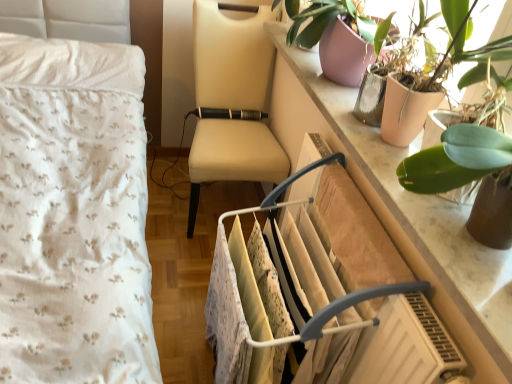
Question: Is white plastic clothes rack at center closer to the viewer compared to green leafy plant at upper right, which appears as the 2th houseplant when viewed from the back?

Choices:
 (A) no
 (B) yes

Answer: (A)

Question: Considering the relative positions of white plastic clothes rack at center and green leafy plant at upper right, which appears as the 2th houseplant when viewed from the back, in the image provided, is white plastic clothes rack at center to the left of green leafy plant at upper right, which appears as the 2th houseplant when viewed from the back, from the viewer's perspective?

Choices:
 (A) yes
 (B) no

Answer: (A)

Question: Considering the relative sizes of white plastic clothes rack at center and green leafy plant at upper right, which appears as the 2th houseplant when viewed from the back, in the image provided, is white plastic clothes rack at center thinner than green leafy plant at upper right, which appears as the 2th houseplant when viewed from the back,?

Choices:
 (A) yes
 (B) no

Answer: (B)

Question: Does white plastic clothes rack at center have a greater height compared to green leafy plant at upper right, the first houseplant in the front-to-back sequence?

Choices:
 (A) yes
 (B) no

Answer: (A)

Question: Does white plastic clothes rack at center have a greater width compared to green leafy plant at upper right, which appears as the 2th houseplant when viewed from the back?

Choices:
 (A) no
 (B) yes

Answer: (B)

Question: From a real-world perspective, relative to beige leather chair at center, is white plastic clothes rack at center vertically above or below?

Choices:
 (A) above
 (B) below

Answer: (B)

Question: Is white plastic clothes rack at center to the left or to the right of beige leather chair at center in the image?

Choices:
 (A) right
 (B) left

Answer: (A)

Question: In terms of size, does white plastic clothes rack at center appear bigger or smaller than beige leather chair at center?

Choices:
 (A) big
 (B) small

Answer: (B)

Question: Is white plastic clothes rack at center wider or thinner than beige leather chair at center?

Choices:
 (A) thin
 (B) wide

Answer: (A)

Question: Would you say green leafy plant at upper right, the first houseplant in the front-to-back sequence, is to the left or to the right of white plastic clothes rack at center in the picture?

Choices:
 (A) right
 (B) left

Answer: (A)

Question: Is green leafy plant at upper right, which appears as the 2th houseplant when viewed from the back, inside the boundaries of white plastic clothes rack at center, or outside?

Choices:
 (A) inside
 (B) outside

Answer: (B)

Question: In terms of width, does green leafy plant at upper right, the first houseplant in the front-to-back sequence, look wider or thinner when compared to white plastic clothes rack at center?

Choices:
 (A) wide
 (B) thin

Answer: (B)

Question: Considering the positions of green leafy plant at upper right, the first houseplant in the front-to-back sequence, and white plastic clothes rack at center in the image, is green leafy plant at upper right, the first houseplant in the front-to-back sequence, taller or shorter than white plastic clothes rack at center?

Choices:
 (A) tall
 (B) short

Answer: (B)

Question: Considering the positions of marble counter top at upper right and white plastic clothes rack at center in the image, is marble counter top at upper right bigger or smaller than white plastic clothes rack at center?

Choices:
 (A) big
 (B) small

Answer: (B)

Question: Is marble counter top at upper right in front of or behind white plastic clothes rack at center in the image?

Choices:
 (A) behind
 (B) front

Answer: (B)